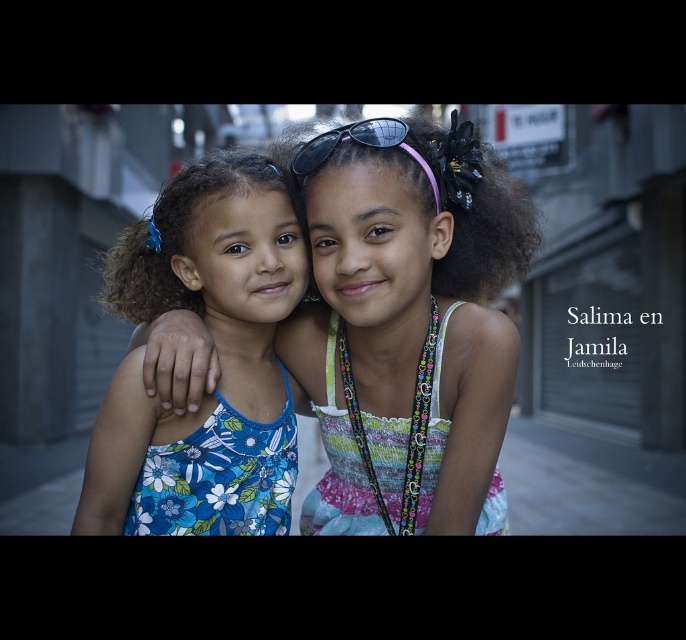
Question: Can you confirm if blue floral dress at left is positioned to the left of sunglasses at center?

Choices:
 (A) yes
 (B) no

Answer: (A)

Question: Can you confirm if floral fabric dress at center is wider than sunglasses at center?

Choices:
 (A) no
 (B) yes

Answer: (B)

Question: Estimate the real-world distances between objects in this image. Which object is farther from the floral fabric dress at center?

Choices:
 (A) blue floral dress at left
 (B) sunglasses at center

Answer: (A)

Question: Among these objects, which one is farthest from the camera?

Choices:
 (A) floral fabric dress at center
 (B) blue floral dress at left

Answer: (B)

Question: Considering the real-world distances, which object is farthest from the floral fabric dress at center?

Choices:
 (A) sunglasses at center
 (B) blue floral dress at left

Answer: (B)

Question: Observing the image, what is the correct spatial positioning of blue floral dress at left in reference to sunglasses at center?

Choices:
 (A) left
 (B) right

Answer: (A)